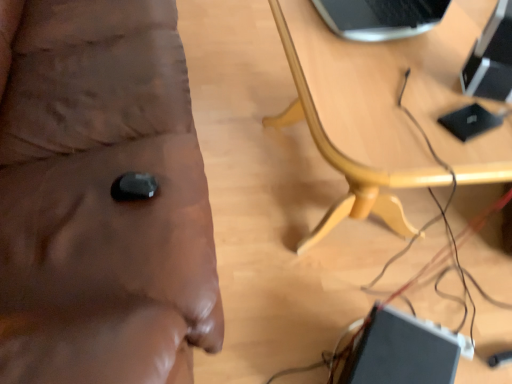
Question: Is wooden table at center positioned far away from wooden table at center?

Choices:
 (A) yes
 (B) no

Answer: (B)

Question: Is wooden table at center outside of wooden table at center?

Choices:
 (A) no
 (B) yes

Answer: (B)

Question: Is the position of wooden table at center less distant than that of wooden table at center?

Choices:
 (A) yes
 (B) no

Answer: (B)

Question: Can you confirm if wooden table at center is taller than wooden table at center?

Choices:
 (A) no
 (B) yes

Answer: (A)

Question: Is wooden table at center surrounded by wooden table at center?

Choices:
 (A) yes
 (B) no

Answer: (B)

Question: Is the depth of wooden table at center greater than that of wooden table at center?

Choices:
 (A) yes
 (B) no

Answer: (A)

Question: From a real-world perspective, is wooden table at center physically above black glossy computer at upper right?

Choices:
 (A) no
 (B) yes

Answer: (A)

Question: From the image's perspective, is wooden table at center located above black glossy computer at upper right?

Choices:
 (A) yes
 (B) no

Answer: (A)

Question: Considering the relative sizes of wooden table at center and black glossy computer at upper right in the image provided, is wooden table at center wider than black glossy computer at upper right?

Choices:
 (A) no
 (B) yes

Answer: (B)

Question: Is wooden table at center aimed at black glossy computer at upper right?

Choices:
 (A) no
 (B) yes

Answer: (B)

Question: Is the depth of wooden table at center less than that of black glossy computer at upper right?

Choices:
 (A) no
 (B) yes

Answer: (B)

Question: Is wooden table at center not within black glossy computer at upper right?

Choices:
 (A) yes
 (B) no

Answer: (A)

Question: Is there a large distance between wooden table at center and wooden table at center?

Choices:
 (A) yes
 (B) no

Answer: (B)